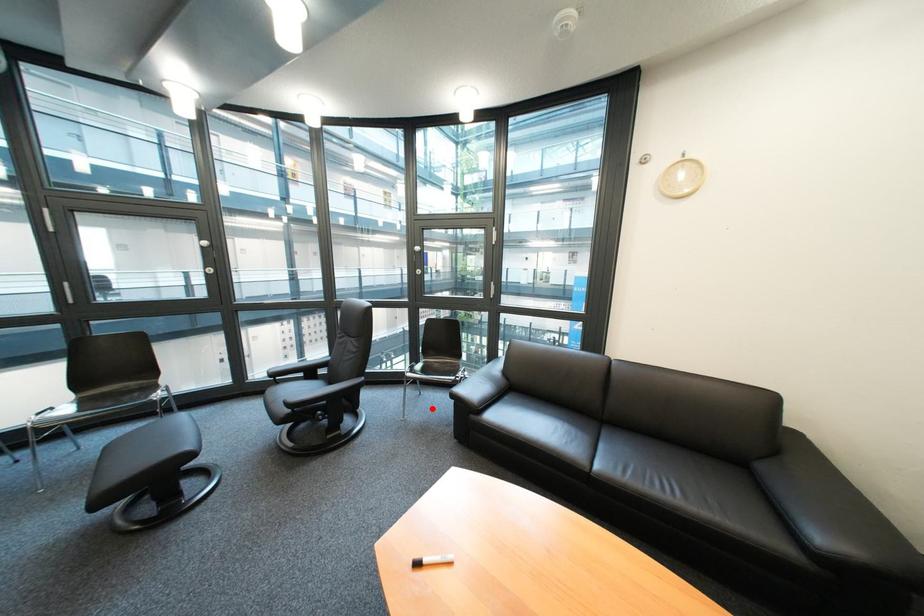
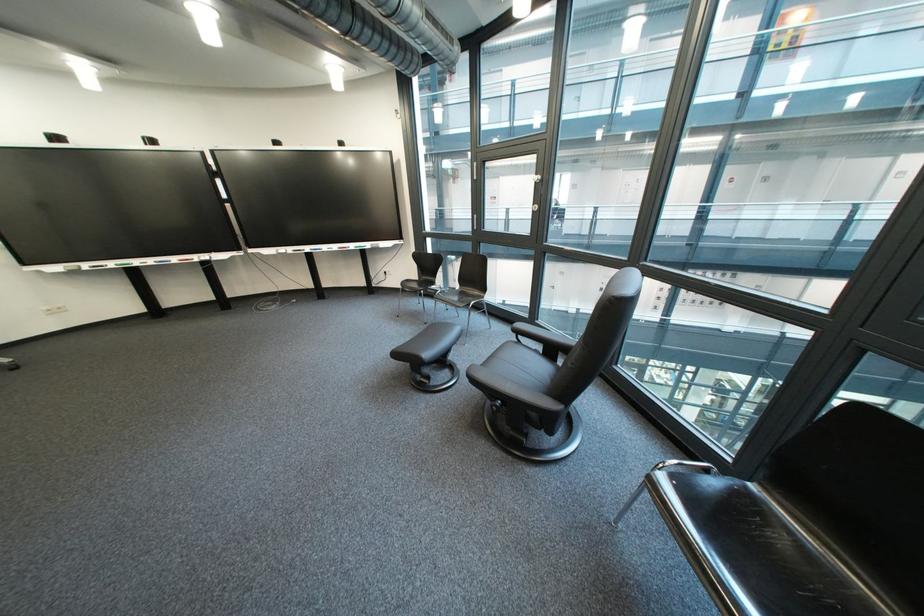
Question: I am providing you with two images of the same scene from different viewpoints. Image1 has a red point marked. In image2, the corresponding 3D location appears at what relative position? Reply with the corresponding letter.

Choices:
 (A) Closer
 (B) Farther

Answer: (B)